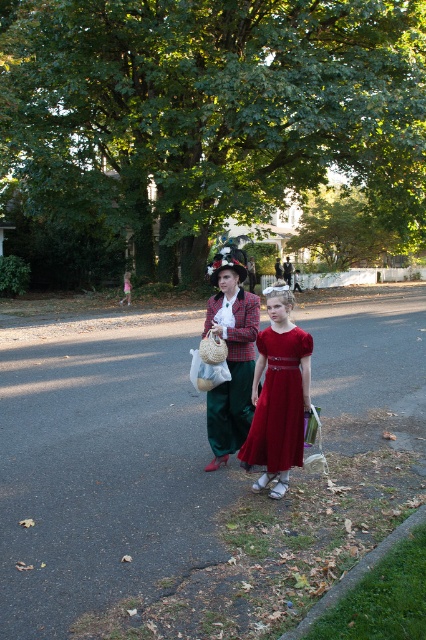
Which is behind, point (216, 433) or point (267, 360)?

Positioned behind is point (216, 433).

Who is higher up, matte plaid coat at center or shiny satin dress at center?

matte plaid coat at center is higher up.

Is point (244, 339) positioned in front of point (261, 330)?

No, it is behind (261, 330).

Where is `matte plaid coat at center`? The height and width of the screenshot is (640, 426). matte plaid coat at center is located at coordinates (230, 355).

Does matte plaid coat at center have a smaller size compared to pink satin dress at center?

Actually, matte plaid coat at center might be larger than pink satin dress at center.

Measure the distance between matte plaid coat at center and pink satin dress at center.

matte plaid coat at center is 9.41 meters away from pink satin dress at center.

Which is in front, point (227, 316) or point (127, 273)?

Point (227, 316)

Find the location of `matte plaid coat at center`. matte plaid coat at center is located at coordinates (230, 355).

Is shiny satin dress at center below pink satin dress at center?

Correct, shiny satin dress at center is located below pink satin dress at center.

Find the location of a particular element. shiny satin dress at center is located at coordinates (278, 403).

Identify the location of shiny satin dress at center. The height and width of the screenshot is (640, 426). (278, 403).

I want to click on shiny satin dress at center, so click(278, 403).